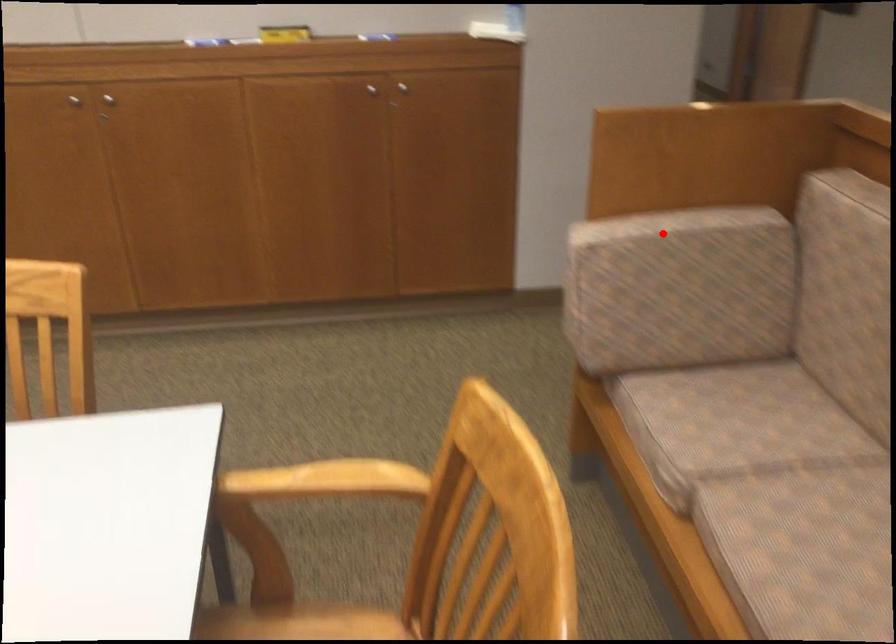
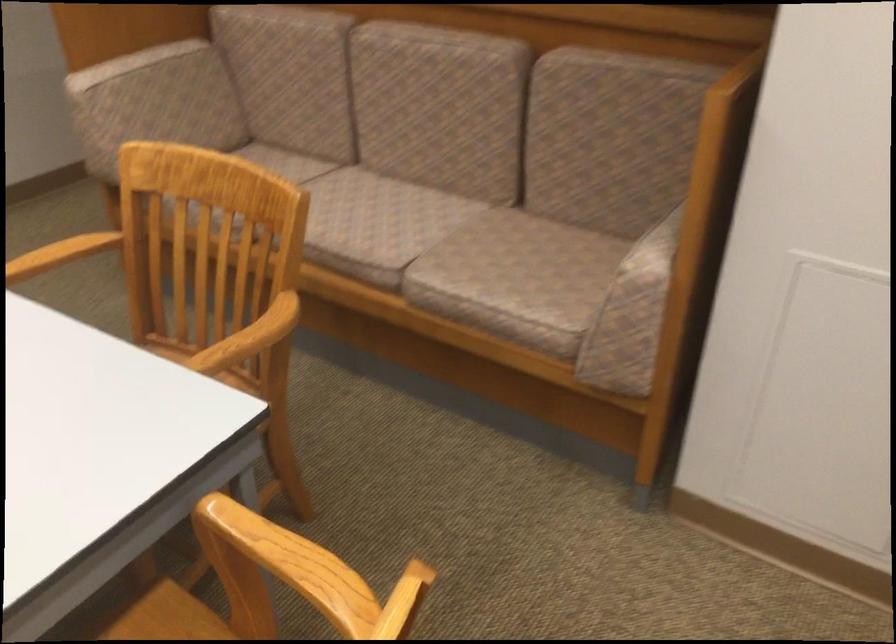
Find the pixel in the second image that matches the highlighted location in the first image.

(138, 64)